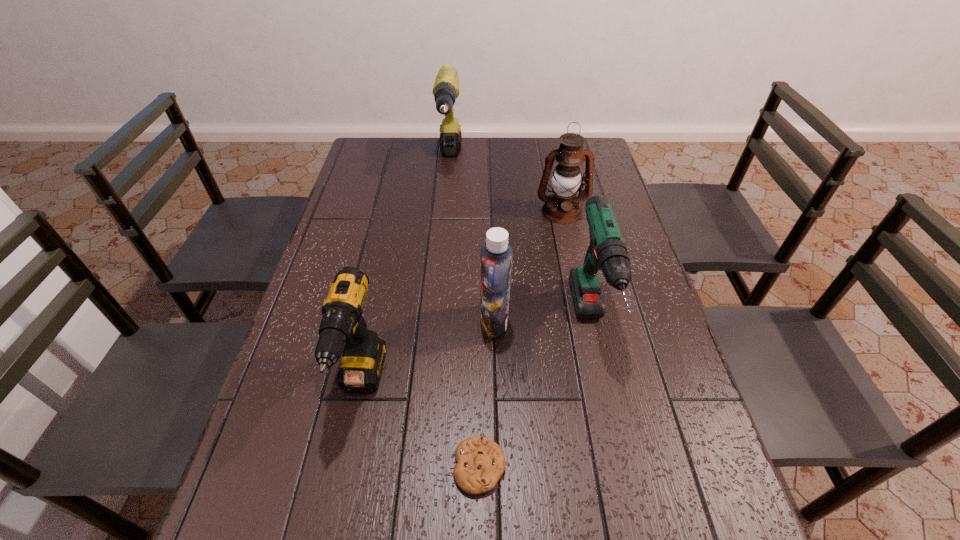
Where is `vacant space that satisfies the following two spatial constraints: 1. on the side of the fifth nearest object, there is a wick adjustment knob; 2. on the front label of the shampoo`? Image resolution: width=960 pixels, height=540 pixels. vacant space that satisfies the following two spatial constraints: 1. on the side of the fifth nearest object, there is a wick adjustment knob; 2. on the front label of the shampoo is located at coordinates (585, 322).